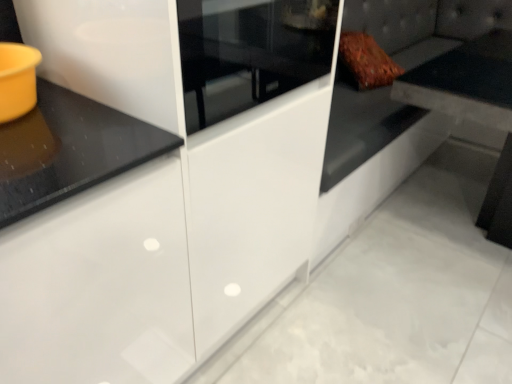
I want to click on leather couch at right, so click(x=416, y=107).

In order to click on matte black table at upper right in this screenshot , I will do `click(466, 82)`.

Based on their sizes in the image, would you say white glossy cabinet at center is bigger or smaller than matte black table at upper right?

Clearly, white glossy cabinet at center is larger in size than matte black table at upper right.

Does point (239, 53) lie in front of point (478, 56)?

That is True.

From the image's perspective, is white glossy cabinet at center located above matte black table at upper right?

Incorrect, from the image's perspective, white glossy cabinet at center is lower than matte black table at upper right.

Between point (448, 37) and point (484, 76), which one is positioned behind?

The point (484, 76) is farther.

Between leather couch at right and matte black table at upper right, which one has smaller width?

With smaller width is matte black table at upper right.

Locate an element on the screen. couch below the matte black table at upper right (from the image's perspective) is located at coordinates (416, 107).

Is point (472, 82) farther from camera compared to point (301, 48)?

Yes, point (472, 82) is behind point (301, 48).

Considering the sizes of objects matte black table at upper right and white glossy cabinet at center in the image provided, who is taller, matte black table at upper right or white glossy cabinet at center?

With more height is white glossy cabinet at center.

How distant is matte black table at upper right from white glossy cabinet at center?

matte black table at upper right is 2.56 meters from white glossy cabinet at center.

From a real-world perspective, which is physically above, matte black table at upper right or white glossy cabinet at center?

white glossy cabinet at center.

From their relative heights in the image, would you say matte black table at upper right is taller or shorter than leather couch at right?

Considering their sizes, matte black table at upper right has more height than leather couch at right.

In the scene shown: Can you confirm if matte black table at upper right is positioned to the left of leather couch at right?

Incorrect, matte black table at upper right is not on the left side of leather couch at right.

From a real-world perspective, is matte black table at upper right positioned above or below leather couch at right?

matte black table at upper right is above leather couch at right.

How many degrees apart are the facing directions of matte black table at upper right and leather couch at right?

There is a 87.4-degree angle between the facing directions of matte black table at upper right and leather couch at right.

I want to click on cabinetry that is below the leather couch at right (from the image's perspective), so click(x=155, y=183).

Based on their sizes in the image, would you say white glossy cabinet at center is bigger or smaller than leather couch at right?

In the image, white glossy cabinet at center appears to be smaller than leather couch at right.

How many degrees apart are the facing directions of white glossy cabinet at center and leather couch at right?

0.804 degrees.

From a real-world perspective, is white glossy cabinet at center located higher than leather couch at right?

Yes, from a real-world perspective, white glossy cabinet at center is above leather couch at right.

From the image's perspective, does leather couch at right appear lower than white glossy cabinet at center?

No.

Is leather couch at right facing away from white glossy cabinet at center?

No, white glossy cabinet at center is not at the back of leather couch at right.

Is leather couch at right completely or partially outside of white glossy cabinet at center?

leather couch at right lies outside white glossy cabinet at center's area.

Is leather couch at right beside white glossy cabinet at center?

There is a gap between leather couch at right and white glossy cabinet at center.

This screenshot has height=384, width=512. I want to click on cabinetry on the left of matte black table at upper right, so click(155, 183).

Where is `table lying on the right of leather couch at right`? Image resolution: width=512 pixels, height=384 pixels. table lying on the right of leather couch at right is located at coordinates (466, 82).

Considering their positions, is white glossy cabinet at center positioned closer to matte black table at upper right than leather couch at right?

leather couch at right is positioned closer to the anchor matte black table at upper right.

Considering their positions, is leather couch at right positioned closer to matte black table at upper right than white glossy cabinet at center?

Based on the image, leather couch at right appears to be nearer to matte black table at upper right.

Based on their spatial positions, is leather couch at right or matte black table at upper right further from white glossy cabinet at center?

Based on the image, matte black table at upper right appears to be further to white glossy cabinet at center.

Estimate the real-world distances between objects in this image. Which object is further from leather couch at right, white glossy cabinet at center or matte black table at upper right?

The object further to leather couch at right is matte black table at upper right.

From the image, which object appears to be nearer to leather couch at right, matte black table at upper right or white glossy cabinet at center?

Among the two, white glossy cabinet at center is located nearer to leather couch at right.

Which object lies further to the anchor point white glossy cabinet at center, matte black table at upper right or leather couch at right?

matte black table at upper right is further to white glossy cabinet at center.

This screenshot has height=384, width=512. I want to click on couch between white glossy cabinet at center and matte black table at upper right in the horizontal direction, so click(416, 107).